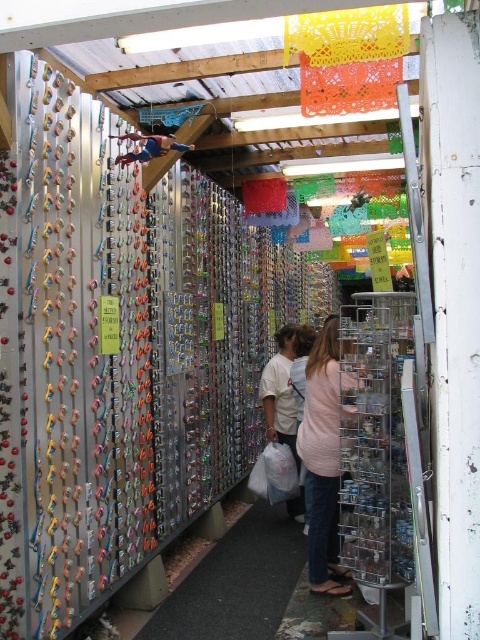
You are a customer at the market stall and want to pick up the white matte plastic bag at center and the blue fabric at upper center. Which object is located to the right of the other?

The white matte plastic bag at center is positioned on the right side of blue fabric at upper center, so the white matte plastic bag at center is to the right of the blue fabric at upper center.